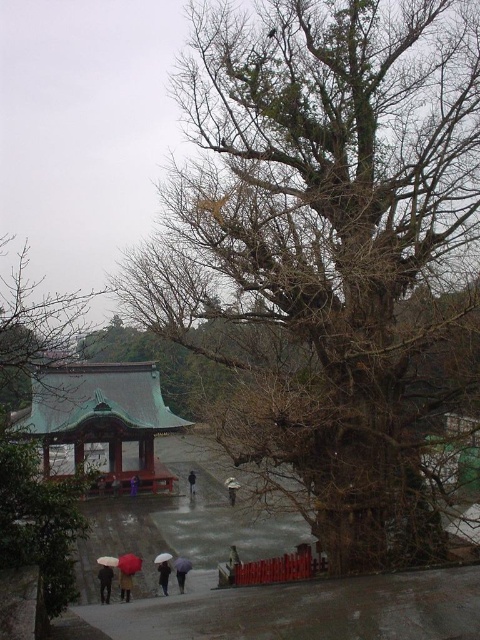
You are standing at the entrance of the shrine complex and see the matte black umbrella at lower left. If you walk directly towards the pavilion, will the large leafless tree on the right block your path to the pavilion?

The large leafless tree on the right is positioned to the side of the path leading to the pavilion, so it will not block your direct path towards the pavilion.

You are standing at the entrance of the shrine and see the red matte umbrella at lower center. If you walk straight towards the pavilion with a green tiled roof and red pillars, will the large leafless tree on the right block your path?

The red matte umbrella at lower center is located at point (129, 563). Since the tree is on the right side of the frame and the path leads straight to the pavilion, the tree would not block your path as you are walking straight towards the pavilion.